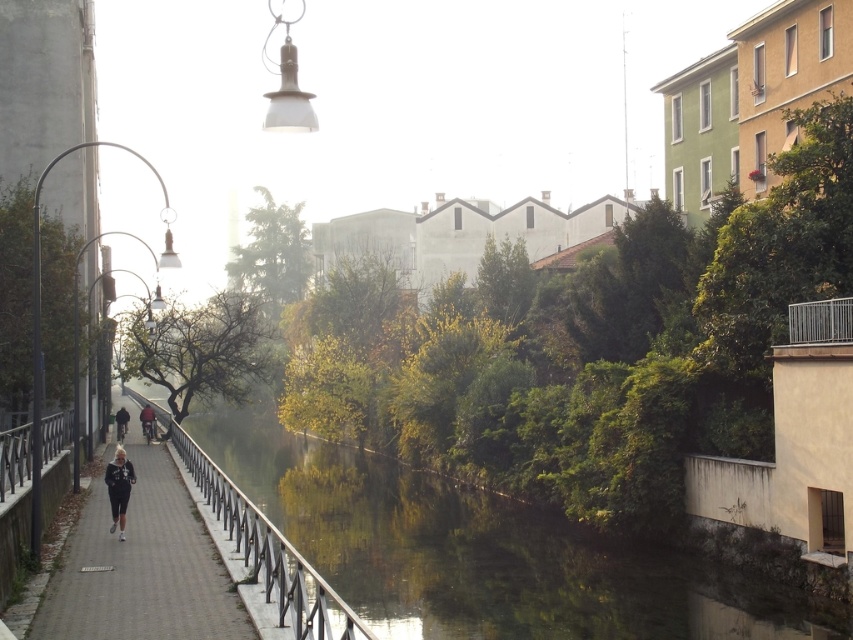
Does green leafy river at center have a larger size compared to dark gray jacket at left?

Correct, green leafy river at center is larger in size than dark gray jacket at left.

Is green leafy river at center closer to camera compared to dark gray jacket at left?

Yes, it is in front of dark gray jacket at left.

Measure the distance between point (x=395, y=509) and camera.

A distance of 128.43 feet exists between point (x=395, y=509) and camera.

Where is `green leafy river at center`? green leafy river at center is located at coordinates (485, 554).

Does dark gray fleece jacket at center lie in front of dark red fabric jacket at center?

Yes.

Looking at this image, which of these two, dark gray fleece jacket at center or dark red fabric jacket at center, stands taller?

With more height is dark gray fleece jacket at center.

Where is `dark gray fleece jacket at center`? This screenshot has height=640, width=853. dark gray fleece jacket at center is located at coordinates (119, 486).

Where is `dark gray fleece jacket at center`? Image resolution: width=853 pixels, height=640 pixels. dark gray fleece jacket at center is located at coordinates (119, 486).

Is the position of gray concrete pavement at center more distant than that of dark gray jacket at left?

No.

Is gray concrete pavement at center smaller than dark gray jacket at left?

Actually, gray concrete pavement at center might be larger than dark gray jacket at left.

This screenshot has width=853, height=640. I want to click on gray concrete pavement at center, so click(x=141, y=566).

At what (x,y) coordinates should I click in order to perform the action: click on gray concrete pavement at center. Please return your answer as a coordinate pair (x, y). Looking at the image, I should click on (141, 566).